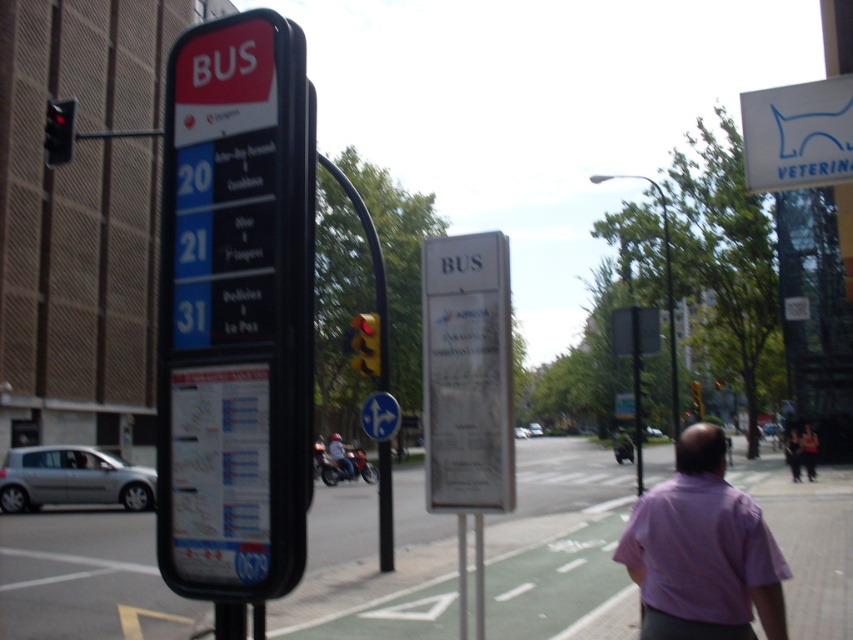
Who is taller, green asphalt pavement at lower center or pink fabric shirt at lower right?

green asphalt pavement at lower center

In the scene shown: Which is more to the left, green asphalt pavement at lower center or pink fabric shirt at lower right?

Positioned to the left is green asphalt pavement at lower center.

Between point (83, 528) and point (793, 445), which one is positioned in front?

Point (83, 528)

At what (x,y) coordinates should I click in order to perform the action: click on green asphalt pavement at lower center. Please return your answer as a coordinate pair (x, y). The width and height of the screenshot is (853, 640). Looking at the image, I should click on (86, 577).

Does pink cotton shirt at lower right appear on the right side of pink fabric shirt at lower right?

In fact, pink cotton shirt at lower right is to the left of pink fabric shirt at lower right.

In the scene shown: Between pink cotton shirt at lower right and pink fabric shirt at lower right, which one has less height?

pink cotton shirt at lower right is shorter.

Does point (813, 451) come behind point (792, 458)?

No.

Identify the location of pink cotton shirt at lower right. Image resolution: width=853 pixels, height=640 pixels. (808, 451).

Is green asphalt pavement at lower center taller than pink cotton shirt at lower right?

Correct, green asphalt pavement at lower center is much taller as pink cotton shirt at lower right.

Can you confirm if green asphalt pavement at lower center is positioned below pink cotton shirt at lower right?

Yes, green asphalt pavement at lower center is below pink cotton shirt at lower right.

Who is more distant from viewer, (120, 600) or (808, 461)?

The point (808, 461) is behind.

You are a GUI agent. You are given a task and a screenshot of the screen. Output one action in this format:
    pyautogui.click(x=<x>, y=<y>)
    Task: Click on the green asphalt pavement at lower center
    
    Given the screenshot: What is the action you would take?
    pyautogui.click(x=86, y=577)